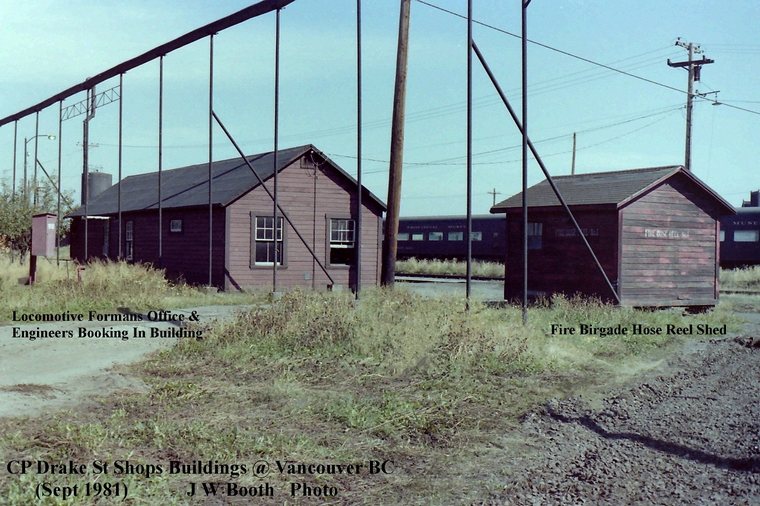
Where is `large windows on house`? The height and width of the screenshot is (506, 760). large windows on house is located at coordinates (260, 229), (337, 233).